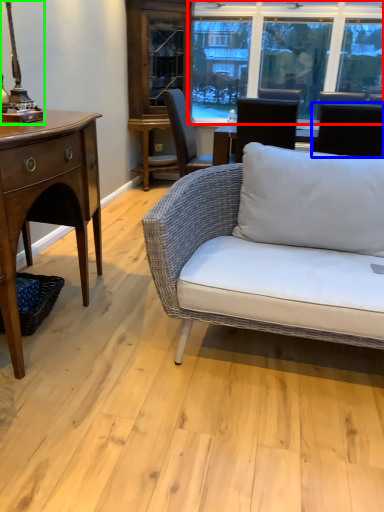
Question: Which is farther away from window (highlighted by a red box)? chair (highlighted by a blue box) or table lamp (highlighted by a green box)?

Choices:
 (A) chair
 (B) table lamp

Answer: (B)